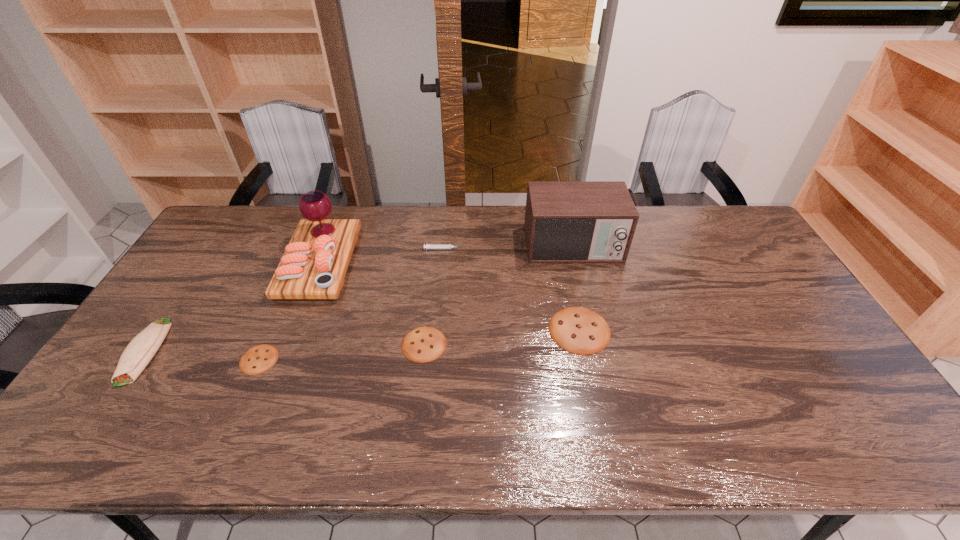
At what (x,y) coordinates should I click in order to perform the action: click on object situated at the left edge. Please return your answer as a coordinate pair (x, y). The width and height of the screenshot is (960, 540). Looking at the image, I should click on coord(139,352).

This screenshot has height=540, width=960. In order to click on object that is positioned at the near left corner in this screenshot , I will do `click(139, 352)`.

This screenshot has height=540, width=960. In the image, there is a desktop. In order to click on vacant space at the far edge in this screenshot , I will do `click(491, 216)`.

Find the location of a particular element. This screenshot has width=960, height=540. free space at the near edge of the desktop is located at coordinates (746, 399).

This screenshot has width=960, height=540. I want to click on free spot at the left edge of the desktop, so tap(164, 368).

Locate an element on the screen. The height and width of the screenshot is (540, 960). free region at the right edge of the desktop is located at coordinates (781, 328).

The height and width of the screenshot is (540, 960). I want to click on unoccupied position between the rightmost cookie and the radio receiver, so click(576, 288).

Image resolution: width=960 pixels, height=540 pixels. I want to click on empty location between the second tallest cookie and the syringe, so click(x=434, y=296).

At what (x,y) coordinates should I click in order to perform the action: click on empty location between the tallest cookie and the platter. Please return your answer as a coordinate pair (x, y). Looking at the image, I should click on (449, 296).

Find the location of a particular element. free space that is in between the leftmost object and the platter is located at coordinates (x=232, y=307).